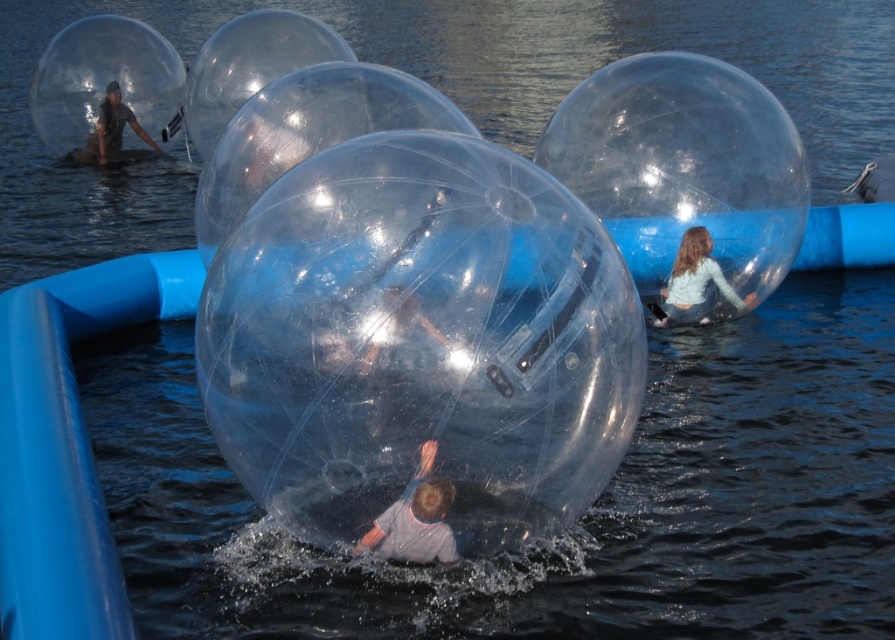
How distant is translucent plastic person at center from transparent plastic person at upper left?

translucent plastic person at center and transparent plastic person at upper left are 25.03 meters apart from each other.

Is translucent plastic person at center closer to the viewer compared to transparent plastic person at upper left?

Yes, it is in front of transparent plastic person at upper left.

Find the location of a particular element. This screenshot has width=895, height=640. translucent plastic person at center is located at coordinates [x=415, y=518].

Which is below, light blue denim jeans at center or transparent plastic person at upper left?

light blue denim jeans at center is lower down.

Is light blue denim jeans at center taller than transparent plastic person at upper left?

In fact, light blue denim jeans at center may be shorter than transparent plastic person at upper left.

At what (x,y) coordinates should I click in order to perform the action: click on light blue denim jeans at center. Please return your answer as a coordinate pair (x, y). This screenshot has width=895, height=640. Looking at the image, I should click on (695, 284).

At what (x,y) coordinates should I click in order to perform the action: click on light blue denim jeans at center. Please return your answer as a coordinate pair (x, y). The width and height of the screenshot is (895, 640). Looking at the image, I should click on (695, 284).

Between translucent plastic person at center and light blue denim jeans at center, which one appears on the left side from the viewer's perspective?

translucent plastic person at center

Is point (390, 540) positioned behind point (691, 269)?

No.

Where is `translucent plastic person at center`? This screenshot has height=640, width=895. translucent plastic person at center is located at coordinates (415, 518).